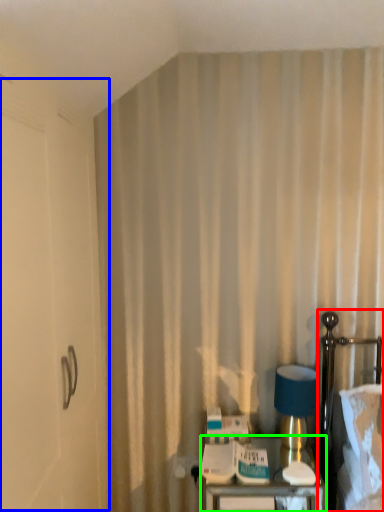
Question: Which object is the closest to the bed (highlighted by a red box)? Choose among these: screen door (highlighted by a blue box) or furniture (highlighted by a green box).

Choices:
 (A) screen door
 (B) furniture

Answer: (B)